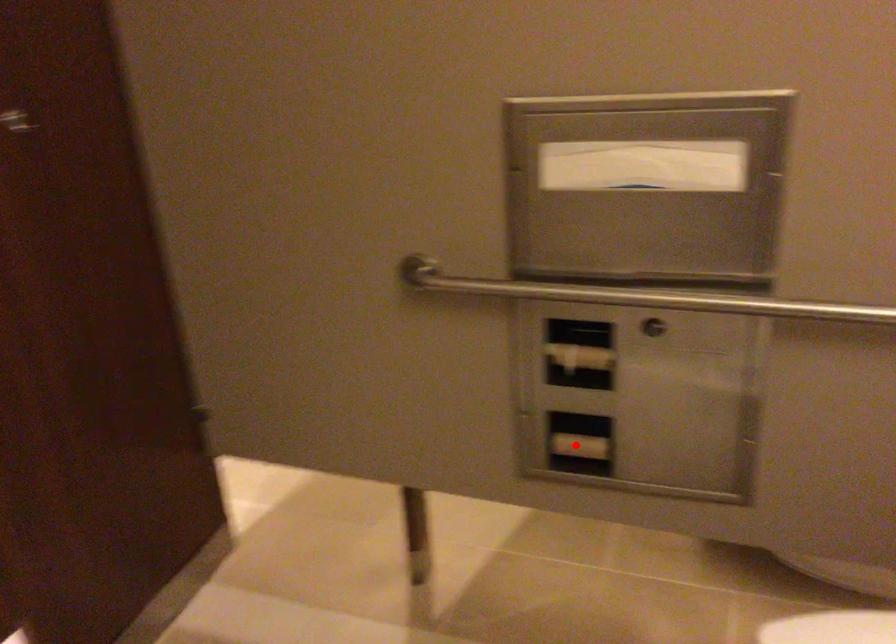
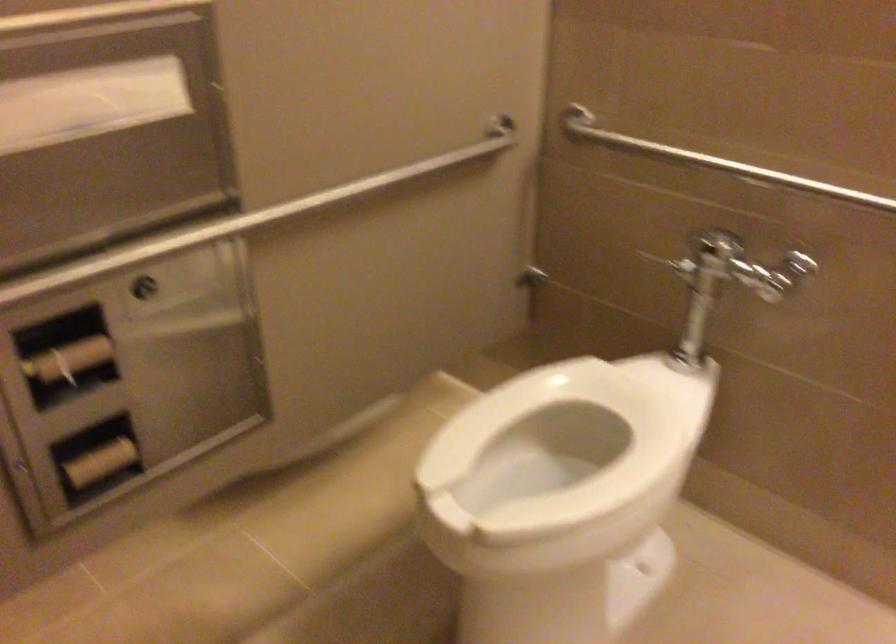
Question: I am providing you with two images of the same scene from different viewpoints. A red point is marked on the first image. Is the red point's position out of view in image 2?

Choices:
 (A) Yes
 (B) No

Answer: (B)